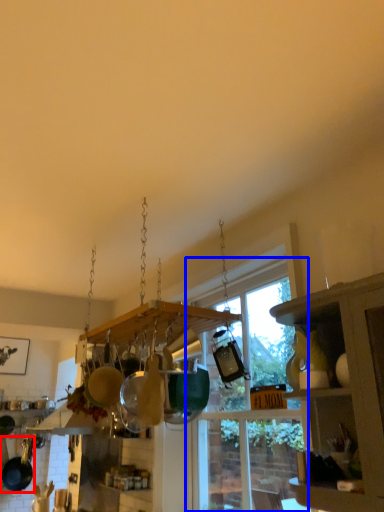
Question: Which of the following is the closest to the observer, frying pan (highlighted by a red box) or window (highlighted by a blue box)?

Choices:
 (A) frying pan
 (B) window

Answer: (B)